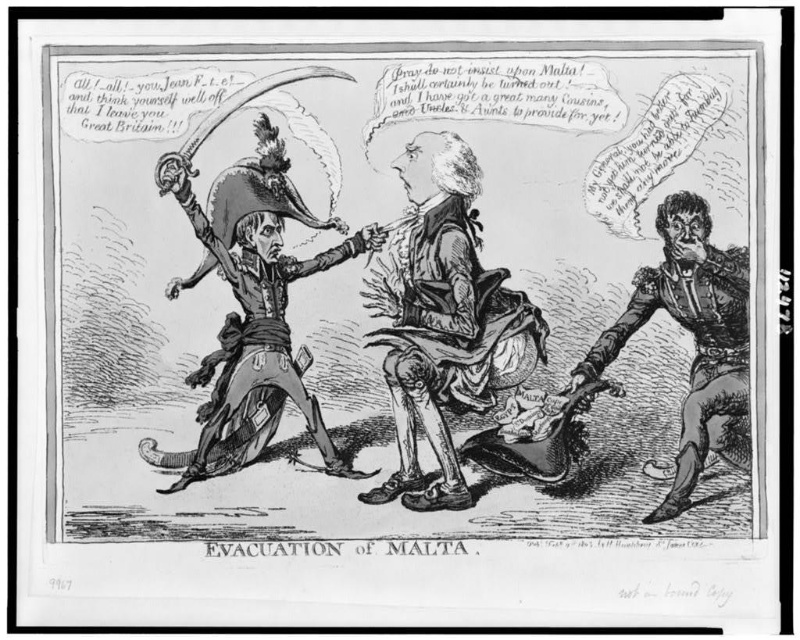
Question: Is shiny black sword at center thinner than smooth leather glove at right?

Choices:
 (A) no
 (B) yes

Answer: (B)

Question: Which point is closer to the camera?

Choices:
 (A) shiny black sword at center
 (B) brushed metal sword at left
 (C) smooth leather glove at right

Answer: (B)

Question: Is shiny black sword at center in front of brushed metal sword at left?

Choices:
 (A) no
 (B) yes

Answer: (A)

Question: Which of the following is the closest to the observer?

Choices:
 (A) shiny black sword at center
 (B) smooth leather glove at right
 (C) brushed metal sword at left

Answer: (C)

Question: Can you confirm if brushed metal sword at left is smaller than smooth leather glove at right?

Choices:
 (A) no
 (B) yes

Answer: (A)

Question: Which object is farther from the camera taking this photo?

Choices:
 (A) brushed metal sword at left
 (B) smooth leather glove at right
 (C) shiny black sword at center

Answer: (B)